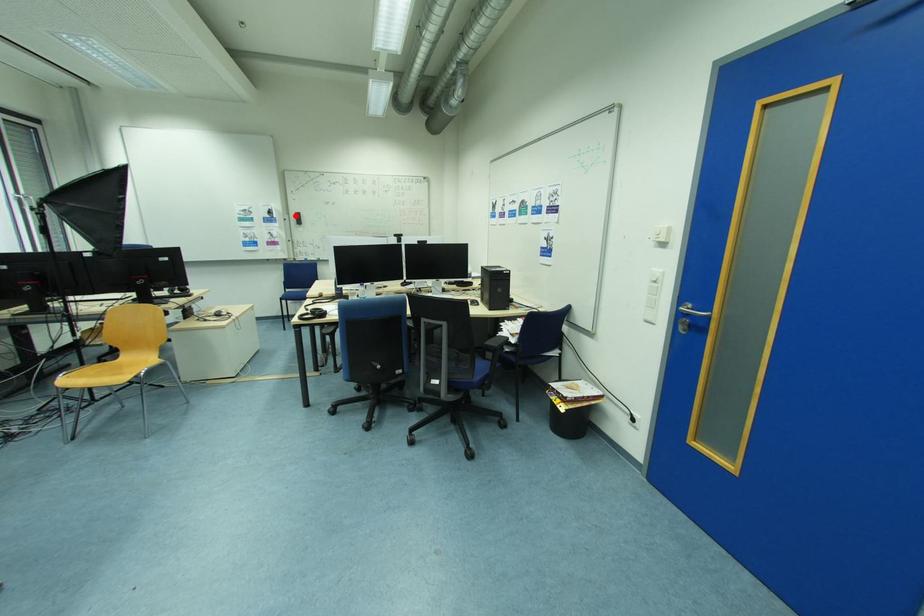
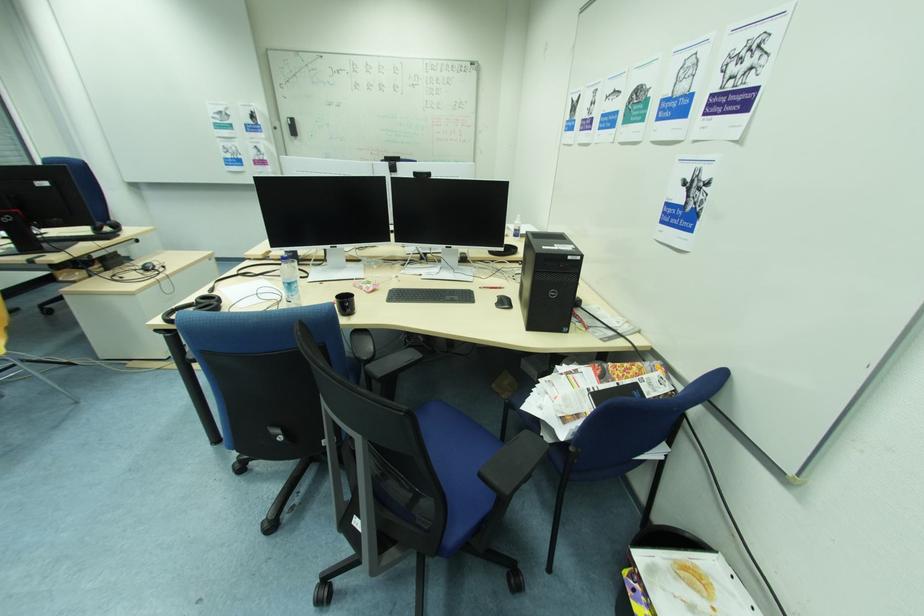
Question: A red point is marked in image1. In image2, is the corresponding 3D point closer to the camera or farther? Reply with the corresponding letter.

Choices:
 (A) The corresponding 3D point is closer.
 (B) The corresponding 3D point is farther.

Answer: (B)